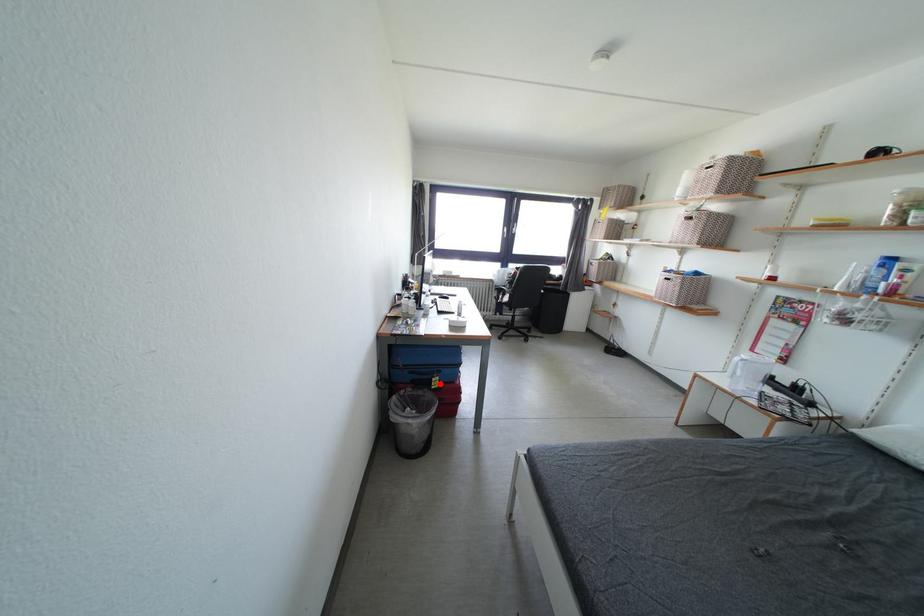
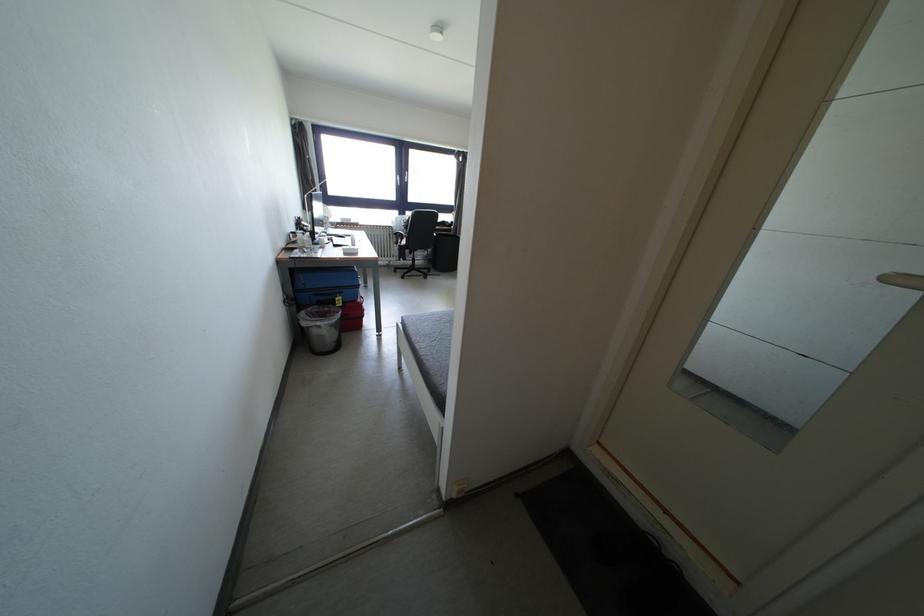
Question: A red point is marked in image1. In image2, is the corresponding 3D point closer to the camera or farther? Reply with the corresponding letter.

Choices:
 (A) The corresponding 3D point is closer.
 (B) The corresponding 3D point is farther.

Answer: (A)